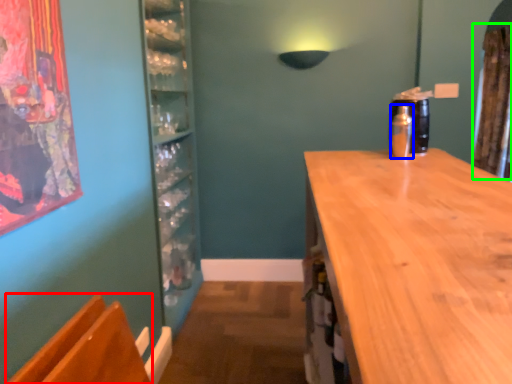
Question: Estimate the real-world distances between objects in this image. Which object is closer to armchair (highlighted by a red box), bottle (highlighted by a blue box) or curtain (highlighted by a green box)?

Choices:
 (A) bottle
 (B) curtain

Answer: (A)